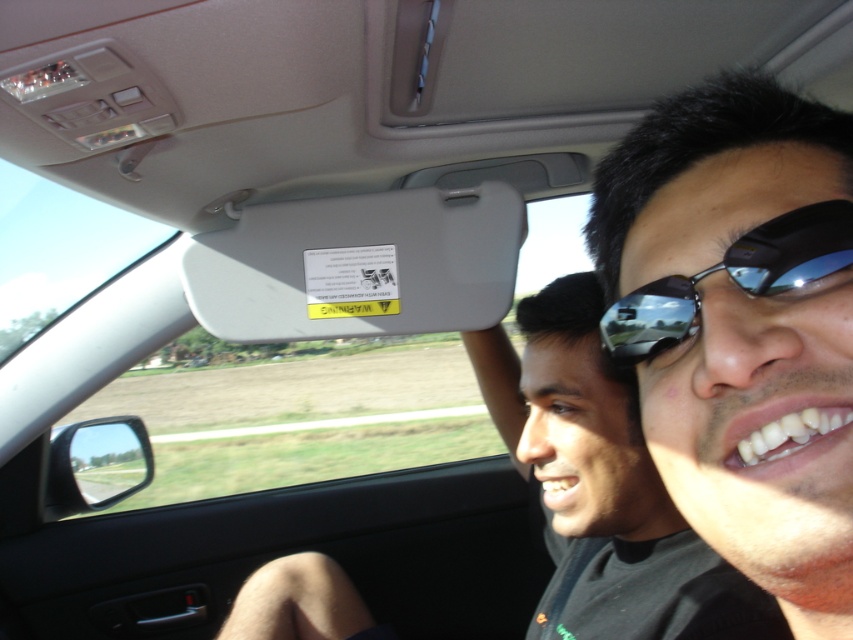
You are a passenger in the car and need to locate your sunglasses. You remember placing them either at the center or upper right of the car interior. Based on the scene, where would you find the sunglasses at center relative to the matte black sunglasses at upper right?

The sunglasses at center is located above the matte black sunglasses at upper right.

You are taking a photo inside the car and want to focus on both the point at coordinates point (698, 188) and the point at coordinates point (548, 433). Which point should you focus on first to ensure both are in sharp focus?

You should focus on point (698, 188) first because it is closer to the camera than point (548, 433). By focusing on the closer point, the depth of field may also keep the farther point in acceptable focus.